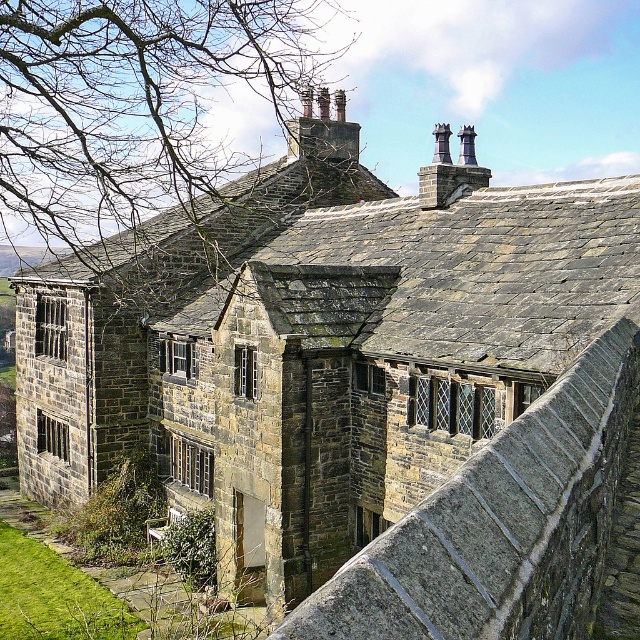
Question: Which of the following is the closest to the observer?

Choices:
 (A) (481, 170)
 (B) (323, 589)

Answer: (B)

Question: Considering the relative positions of stone ledge at upper center and dark gray stone chimney at upper center in the image provided, where is stone ledge at upper center located with respect to dark gray stone chimney at upper center?

Choices:
 (A) left
 (B) right

Answer: (A)

Question: Which of the following is the farthest from the observer?

Choices:
 (A) stone ledge at upper center
 (B) dark gray stone chimney at upper center

Answer: (B)

Question: Which object is positioned farthest from the bare branches at upper center?

Choices:
 (A) stone ledge at upper center
 (B) dark gray stone chimney at upper center

Answer: (A)

Question: In this image, where is bare branches at upper center located relative to stone ledge at upper center?

Choices:
 (A) left
 (B) right

Answer: (A)

Question: Is the position of bare branches at upper center more distant than that of dark gray stone chimney at upper center?

Choices:
 (A) no
 (B) yes

Answer: (A)